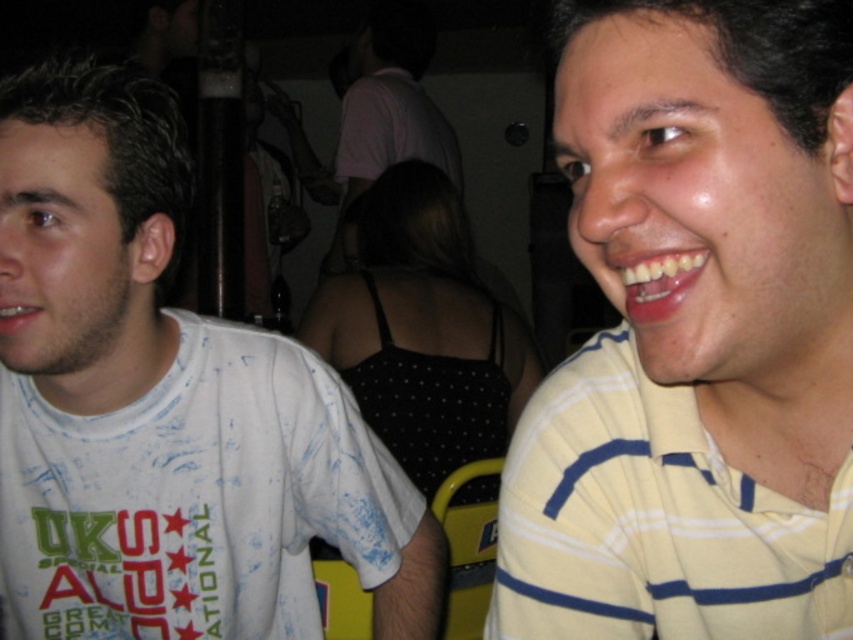
Does white printed t-shirt at left have a smaller size compared to glossy white teeth at center?

Incorrect, white printed t-shirt at left is not smaller in size than glossy white teeth at center.

What do you see at coordinates (166, 406) in the screenshot? I see `white printed t-shirt at left` at bounding box center [166, 406].

Where is `white printed t-shirt at left`? white printed t-shirt at left is located at coordinates (166, 406).

This screenshot has width=853, height=640. Identify the location of white printed t-shirt at left. (166, 406).

Based on the photo, who is positioned more to the left, white printed t-shirt at left or white glossy teeth at lower left?

white glossy teeth at lower left

Is point (286, 440) closer to camera compared to point (33, 310)?

No, (286, 440) is behind (33, 310).

The height and width of the screenshot is (640, 853). What are the coordinates of `white printed t-shirt at left` in the screenshot? It's located at (166, 406).

What do you see at coordinates (695, 336) in the screenshot?
I see `yellow striped shirt at right` at bounding box center [695, 336].

Does yellow striped shirt at right have a smaller size compared to white matte shirt at center?

Correct, yellow striped shirt at right occupies less space than white matte shirt at center.

Is point (676, 541) in front of point (355, 58)?

Yes.

Where is `yellow striped shirt at right`? This screenshot has width=853, height=640. yellow striped shirt at right is located at coordinates (695, 336).